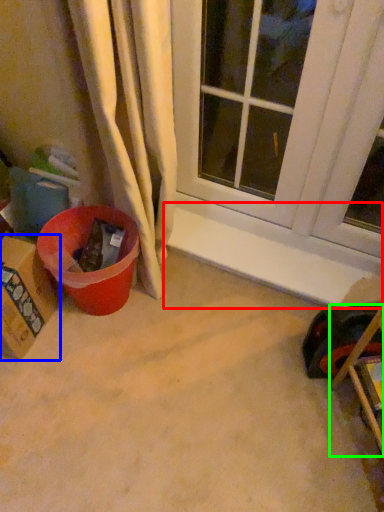
Question: Based on their relative distances, which object is farther from window sill (highlighted by a red box)? Choose from cardboard box (highlighted by a blue box) and furniture (highlighted by a green box).

Choices:
 (A) cardboard box
 (B) furniture

Answer: (A)